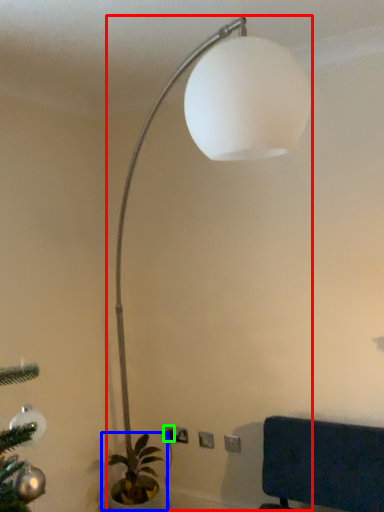
Question: Which is farther away from lamp (highlighted by a red box)? houseplant (highlighted by a blue box) or electric outlet (highlighted by a green box)?

Choices:
 (A) houseplant
 (B) electric outlet

Answer: (B)